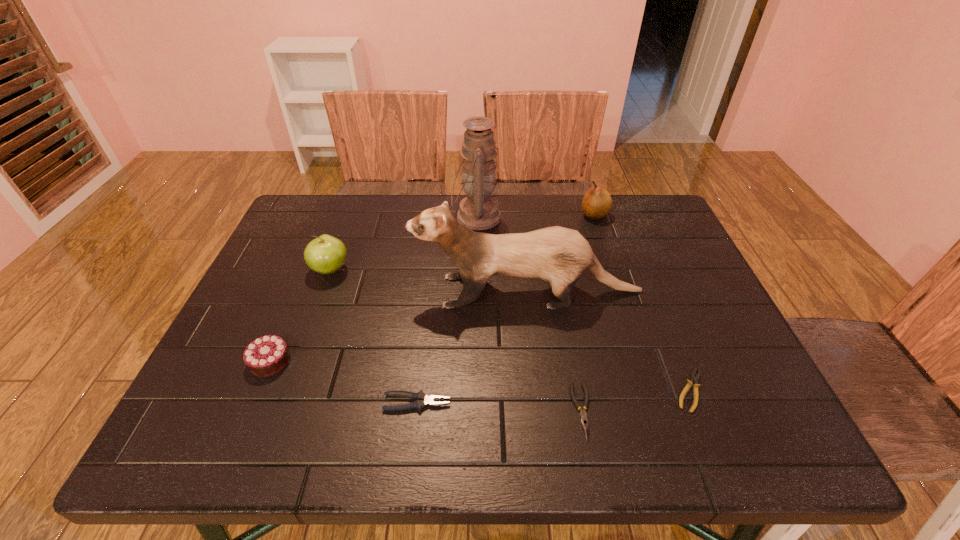
The width and height of the screenshot is (960, 540). What are the coordinates of `free space between the shortest object and the second tallest pliers` in the screenshot? It's located at (636, 401).

You are a GUI agent. You are given a task and a screenshot of the screen. Output one action in this format:
    pyautogui.click(x=<x>, y=<y>)
    Task: Click on the object that is the second closest one to the chocolate cake
    Image resolution: width=960 pixels, height=540 pixels.
    Given the screenshot: What is the action you would take?
    pyautogui.click(x=422, y=400)

Select which object appears as the third closest to the leftmost pliers. Please provide its 2D coordinates. Your answer should be formatted as a tuple, i.e. [(x, y)], where the tuple contains the x and y coordinates of a point satisfying the conditions above.

[(583, 415)]

The image size is (960, 540). Identify the location of pliers that stands as the closest to the rightmost pliers. [x=583, y=415].

Where is `pliers that can be found as the second closest to the seventh shortest object`? The height and width of the screenshot is (540, 960). pliers that can be found as the second closest to the seventh shortest object is located at coordinates (583, 415).